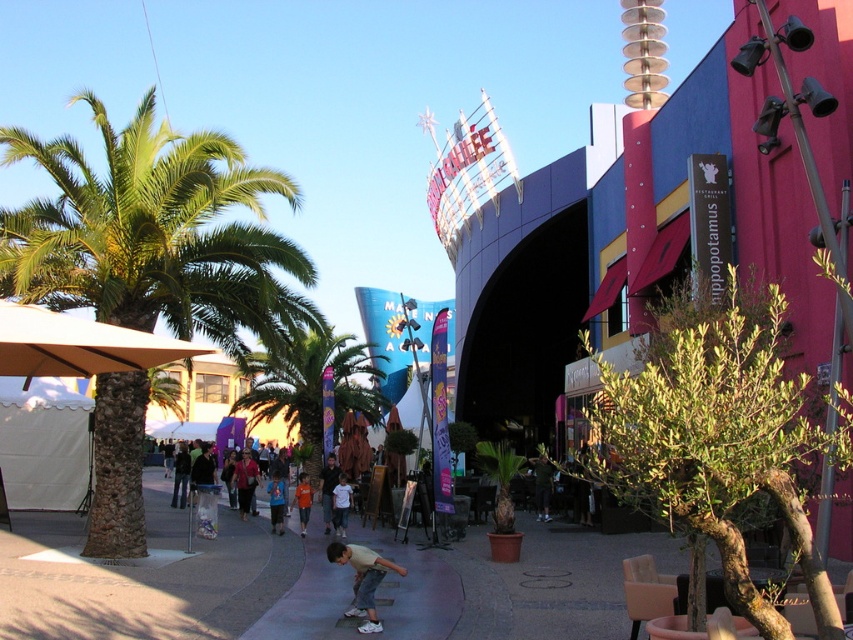
Question: Among these objects, which one is farthest from the camera?

Choices:
 (A) denim shorts at lower center
 (B) orange cotton shirt at lower center
 (C) green leafy palm tree at center
 (D) light brown wooden skateboard at lower center

Answer: (A)

Question: Is green leafy palm tree at left above light brown shirt at lower center?

Choices:
 (A) yes
 (B) no

Answer: (A)

Question: Which point is farther to the camera?

Choices:
 (A) (300, 497)
 (B) (328, 493)
 (C) (192, 211)
 (D) (262, 400)

Answer: (D)

Question: Observing the image, what is the correct spatial positioning of green leafy palm tree at center in reference to denim shorts at lower center?

Choices:
 (A) below
 (B) above

Answer: (B)

Question: Does denim shorts at lower center have a greater width compared to orange cotton shirt at lower center?

Choices:
 (A) no
 (B) yes

Answer: (A)

Question: Which point is closer to the camera?

Choices:
 (A) (260, 408)
 (B) (300, 500)
 (C) (321, 499)

Answer: (B)